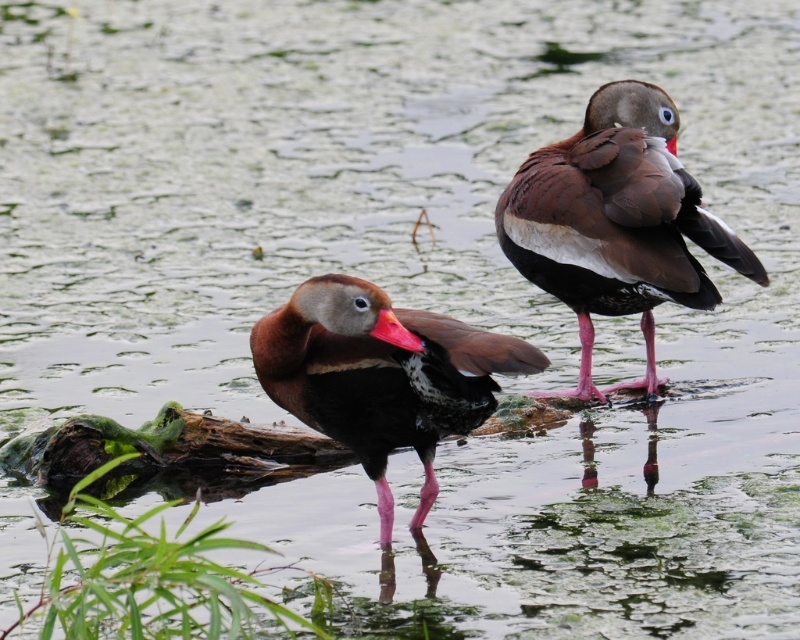
Which is behind, point (474, 413) or point (388, 330)?

Positioned behind is point (474, 413).

Is brown glossy duck at center above rubberized red beak at center?

No.

Between point (445, 364) and point (420, 344), which one is positioned in front?

Point (420, 344) is more forward.

At what (x,y) coordinates should I click in order to perform the action: click on brown glossy duck at center. Please return your answer as a coordinate pair (x, y). This screenshot has width=800, height=640. Looking at the image, I should click on (381, 376).

Does brown glossy duck at upper right appear on the left side of rubberized red beak at center?

Incorrect, brown glossy duck at upper right is not on the left side of rubberized red beak at center.

Does point (612, 100) lie in front of point (410, 342)?

No, it is behind (410, 342).

The width and height of the screenshot is (800, 640). What do you see at coordinates (616, 221) in the screenshot?
I see `brown glossy duck at upper right` at bounding box center [616, 221].

What are the coordinates of `brown glossy duck at upper right` in the screenshot? It's located at (616, 221).

Between brown glossy duck at upper right and brown glossy duck at center, which one appears on the left side from the viewer's perspective?

brown glossy duck at center

Between brown glossy duck at upper right and brown glossy duck at center, which one has less height?

brown glossy duck at center is shorter.

Identify the location of brown glossy duck at upper right. (616, 221).

This screenshot has height=640, width=800. In order to click on brown glossy duck at upper right in this screenshot , I will do `click(616, 221)`.